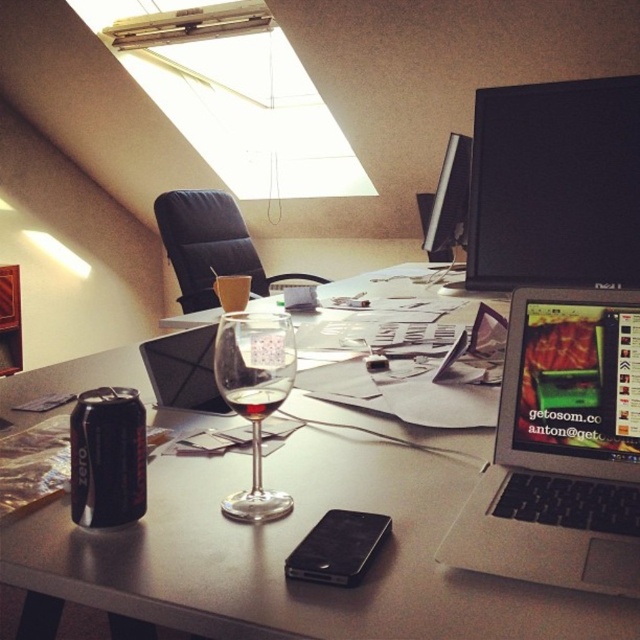
You are organizing the desk and need to place a new item that requires more space than the clear glass wine glass at center. Which object on the desk can you place it next to without moving the satin black monitor at upper center?

You can place the new item next to the satin black monitor at upper center because it is larger than the clear glass wine glass at center, providing more space.

You are standing in the loft workspace and want to reach both the point at coordinates (515,570) and the point at (88,480). Which point should you target first if you want to reach the closer one first?

You should target point (515,570) first because it is closer to you than point (88,480).